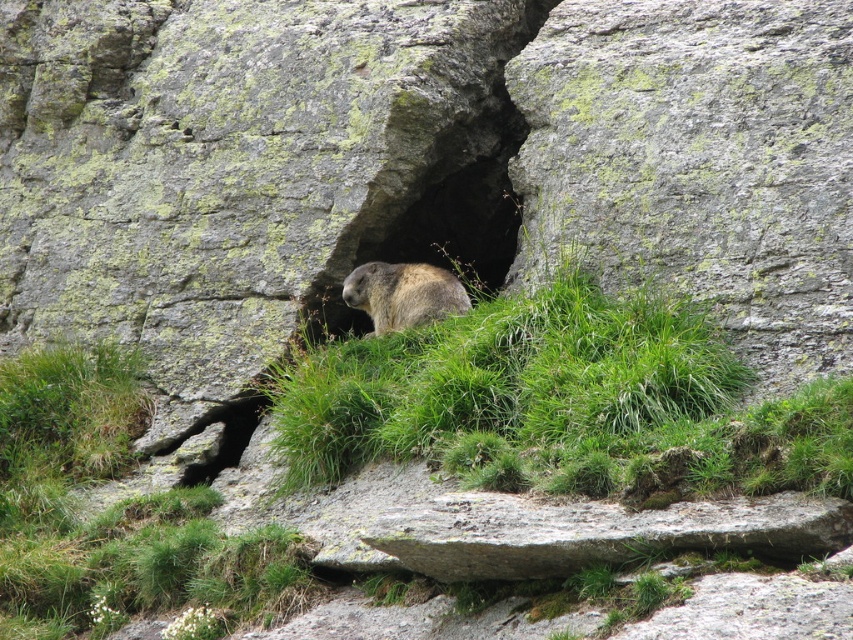
Looking at this image, you are a small animal trying to hide from the rain. You see the green grassy at center and the brown fur at center. Which location offers better shelter from the rain?

The brown fur at center offers better shelter from the rain because it is taller than the green grassy at center.

You are standing at a point 11.50 meters away from the rock formation where the marmot is hiding. If you want to throw a small pebble to the point marked as point (33, 412), which is exactly where the marmot is, will you be able to reach it from your current position?

The distance of point (33, 412) from viewer is 11.50 meters. Since you are already at that distance, you can reach it by throwing the pebble accurately to the point (33, 412).

You are standing at the origin point of the coordinate system in the image. The green grassy area is located at point 0.803, 0.135. If you want to walk towards the green grassy at center, in which direction should you move?

To reach the green grassy at center located at coordinates [114,513], you should move towards the right and slightly downward from your current position at the origin.